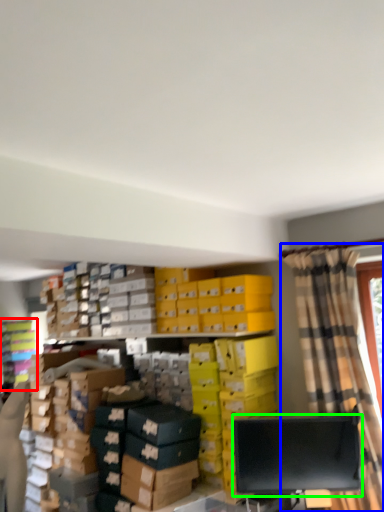
Question: Based on their relative distances, which object is farther from shelf (highlighted by a red box)? Choose from curtain (highlighted by a blue box) and computer monitor (highlighted by a green box).

Choices:
 (A) curtain
 (B) computer monitor

Answer: (A)